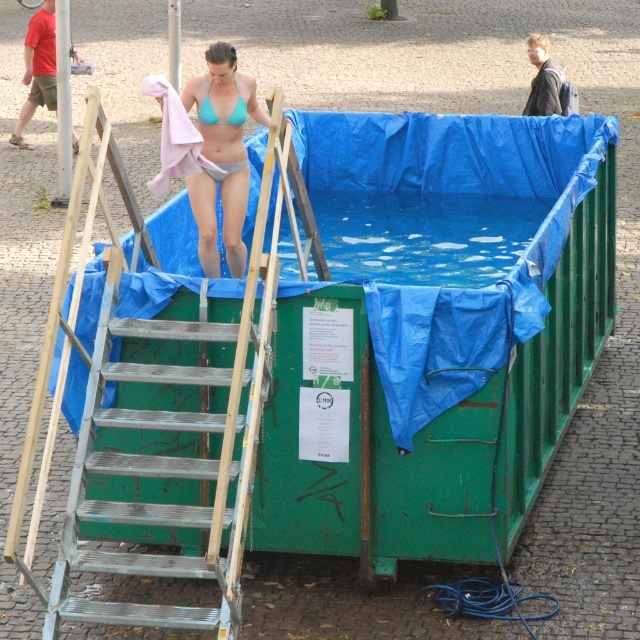
Question: Based on their relative distances, which object is nearer to the teal matte bikini at center?

Choices:
 (A) metallic silver ladder at left
 (B) teal matte bikini top at upper center

Answer: (B)

Question: Is metallic silver ladder at left wider than teal matte bikini top at upper center?

Choices:
 (A) no
 (B) yes

Answer: (B)

Question: Considering the relative positions of metallic silver ladder at left and teal matte bikini top at upper center in the image provided, where is metallic silver ladder at left located with respect to teal matte bikini top at upper center?

Choices:
 (A) below
 (B) above

Answer: (A)

Question: Estimate the real-world distances between objects in this image. Which object is farther from the metallic silver ladder at left?

Choices:
 (A) teal matte bikini at center
 (B) teal matte bikini top at upper center

Answer: (B)

Question: Does metallic silver ladder at left lie behind teal matte bikini at center?

Choices:
 (A) yes
 (B) no

Answer: (B)

Question: Which point appears closest to the camera in this image?

Choices:
 (A) (240, 81)
 (B) (188, 429)
 (C) (205, 109)

Answer: (B)